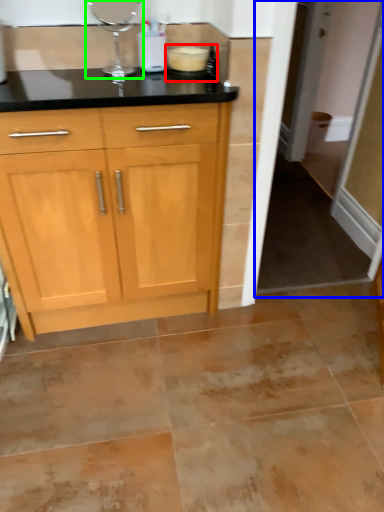
Question: Which is nearer to the appliance (highlighted by a red box)? screen door (highlighted by a blue box) or appliance (highlighted by a green box).

Choices:
 (A) screen door
 (B) appliance

Answer: (B)